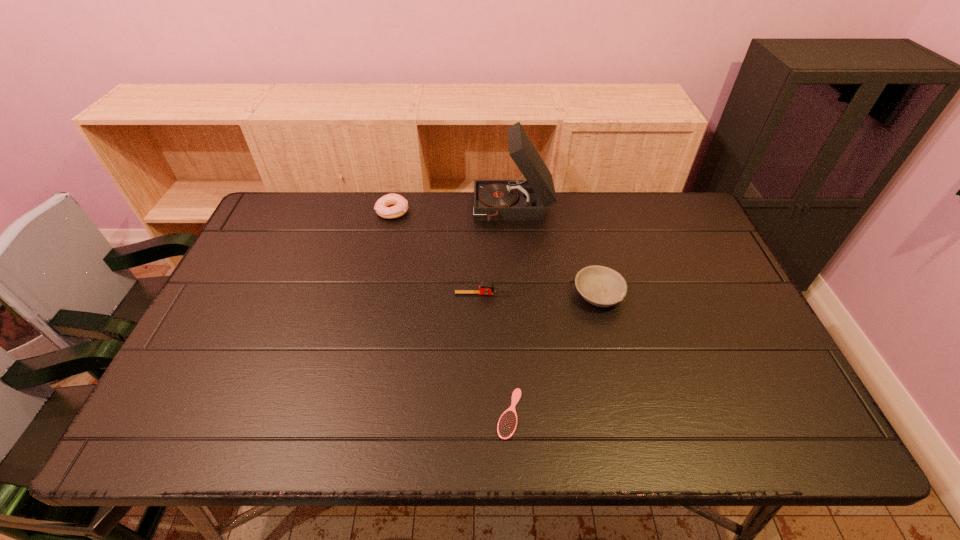
Identify the location of free region located on the back of the bowl. Image resolution: width=960 pixels, height=540 pixels. (575, 201).

You are a GUI agent. You are given a task and a screenshot of the screen. Output one action in this format:
    pyautogui.click(x=<x>, y=<y>)
    Task: Click on the vacant region located on the back of the tape measure
    The height and width of the screenshot is (540, 960).
    Given the screenshot: What is the action you would take?
    pyautogui.click(x=483, y=247)

Locate an element on the screen. Image resolution: width=960 pixels, height=540 pixels. free space located on the back of the hairbrush is located at coordinates (503, 287).

Where is `phonograph_record present at the far edge`? The height and width of the screenshot is (540, 960). phonograph_record present at the far edge is located at coordinates click(x=494, y=200).

Find the location of `doughnut located in the far edge section of the desktop`. doughnut located in the far edge section of the desktop is located at coordinates (400, 207).

Where is `object positioned at the near edge`? object positioned at the near edge is located at coordinates (x=507, y=424).

In the image, there is a desktop. Identify the location of free region at the far edge. This screenshot has height=540, width=960. pos(588,205).

In the image, there is a desktop. At what (x,y) coordinates should I click in order to perform the action: click on vacant region at the near edge. Please return your answer as a coordinate pair (x, y). The width and height of the screenshot is (960, 540). Looking at the image, I should click on (404, 440).

You are a GUI agent. You are given a task and a screenshot of the screen. Output one action in this format:
    pyautogui.click(x=<x>, y=<y>)
    Task: Click on the vacant region at the left edge
    The height and width of the screenshot is (540, 960).
    Given the screenshot: What is the action you would take?
    pyautogui.click(x=224, y=361)

Where is `vacant area at the far right corner of the desktop`? Image resolution: width=960 pixels, height=540 pixels. vacant area at the far right corner of the desktop is located at coordinates (652, 196).